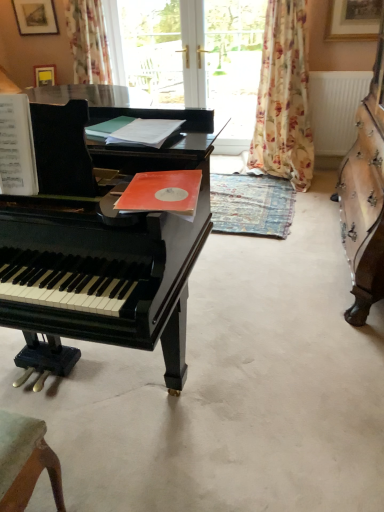
Find the location of a particular element. blank space above white plastic radiator at upper right (from a real-world perspective) is located at coordinates (334, 68).